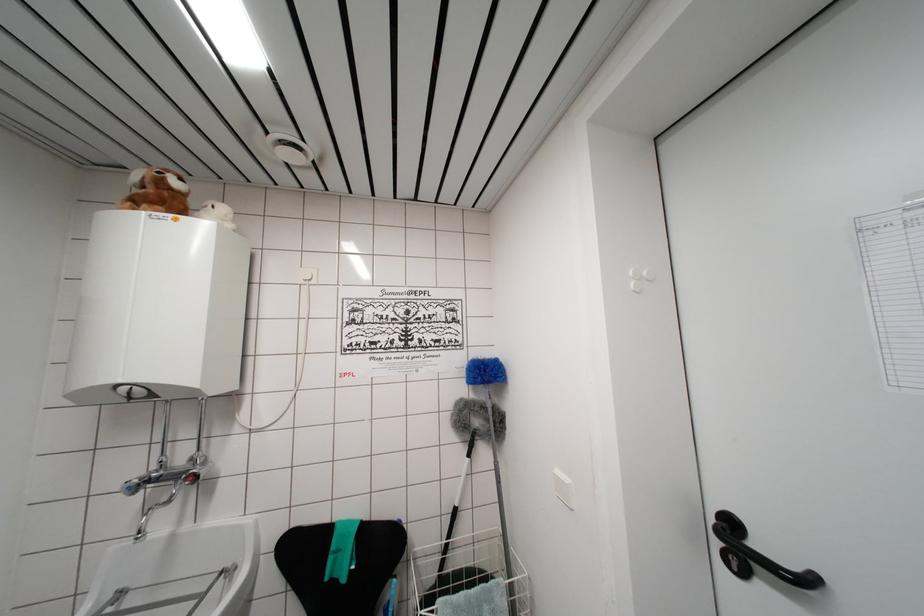
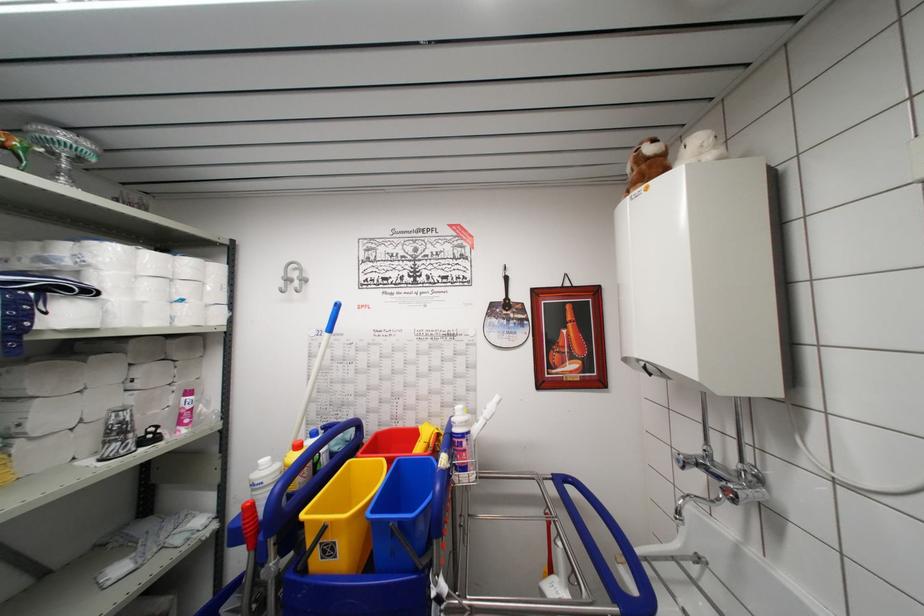
The point at (x=142, y=538) is marked in the first image. Where is the corresponding point in the second image?

(681, 517)